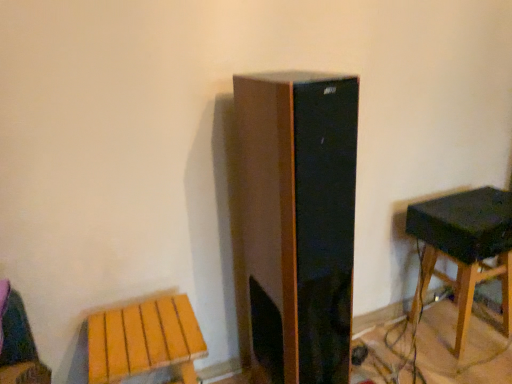
Question: From a real-world perspective, is black matte speaker at right physically located above or below wooden stool at right, which ranks as the 1th stool in right-to-left order?

Choices:
 (A) above
 (B) below

Answer: (A)

Question: Looking at the image, does black matte speaker at right seem bigger or smaller compared to wooden stool at right, the 1th stool from the back?

Choices:
 (A) small
 (B) big

Answer: (A)

Question: Which is farther from the black matte speaker at right?

Choices:
 (A) wooden stool at lower left, which is counted as the 1th stool, starting from the left
 (B) wooden stool at right, the 1th stool from the back

Answer: (A)

Question: Which of these objects is positioned farthest from the wooden stool at lower left, which is counted as the 1th stool, starting from the left?

Choices:
 (A) wooden stool at right, the 1th stool from the back
 (B) black matte speaker at right

Answer: (A)